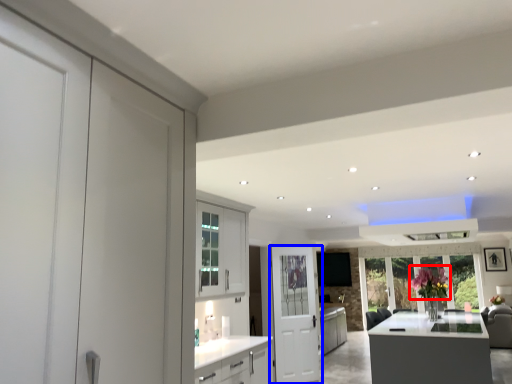
Question: Among these objects, which one is nearest to the camera, flower (highlighted by a red box) or door (highlighted by a blue box)?

Choices:
 (A) flower
 (B) door

Answer: (A)